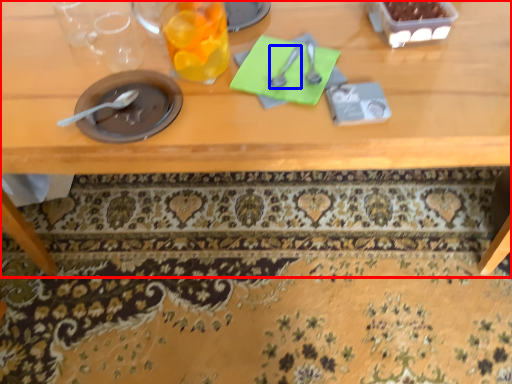
Question: Which of the following is the closest to the observer, table (highlighted by a red box) or tableware (highlighted by a blue box)?

Choices:
 (A) table
 (B) tableware

Answer: (A)